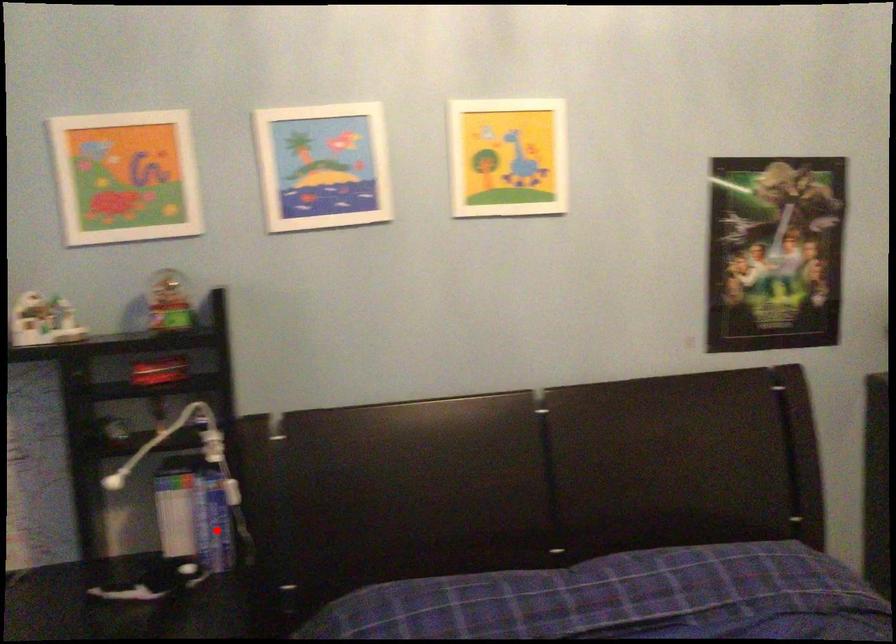
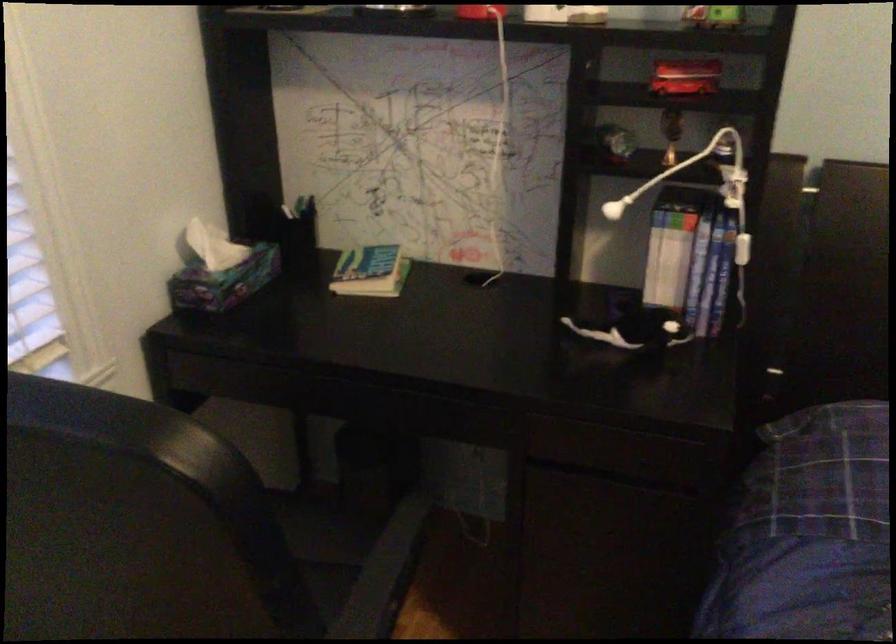
The point at the highlighted location is marked in the first image. Where is the corresponding point in the second image?

(707, 288)